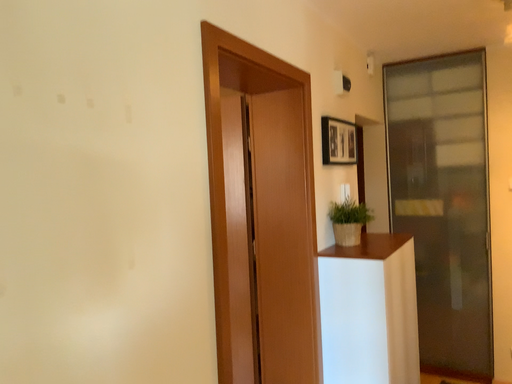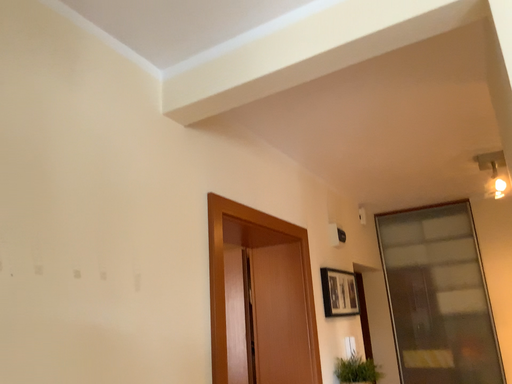
Question: Which way did the camera rotate in the video?

Choices:
 (A) rotated upward
 (B) rotated downward

Answer: (A)